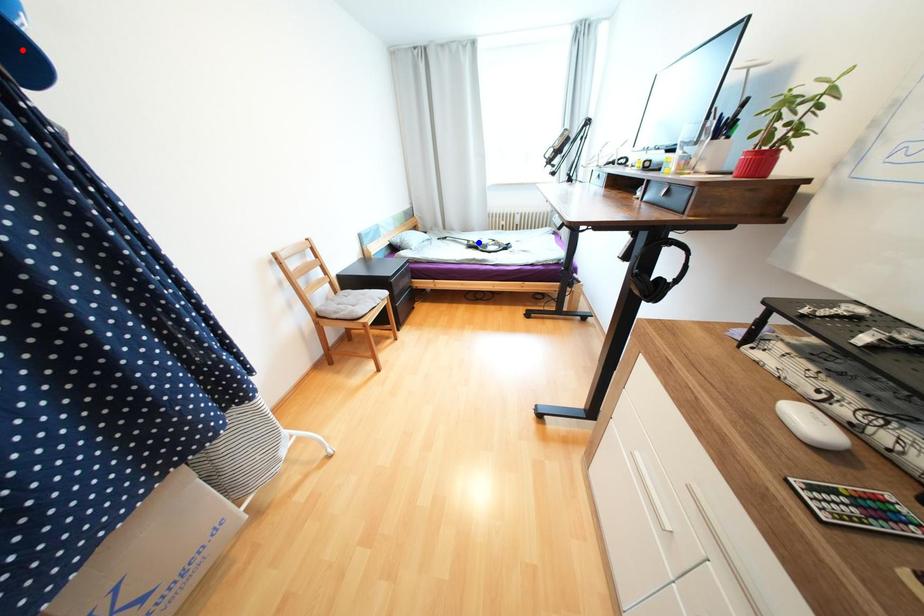
Question: In the image, two points are highlighted. Which point is nearer to the camera? Reply with the corresponding letter.

Choices:
 (A) blue point
 (B) red point

Answer: (B)